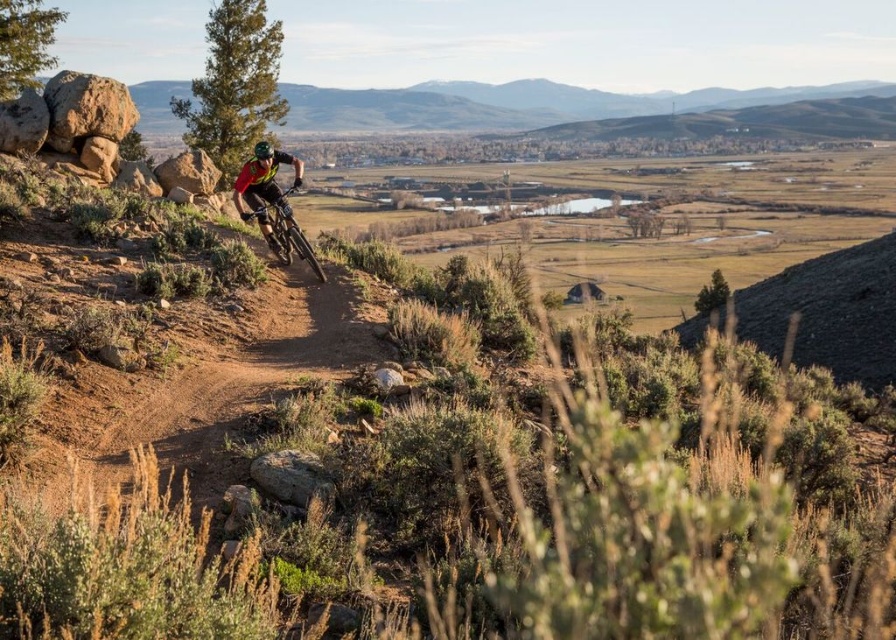
Which of these two, red fabric helmet at center or shiny metallic bicycle at center, stands shorter?

shiny metallic bicycle at center is shorter.

Can you confirm if red fabric helmet at center is wider than shiny metallic bicycle at center?

Indeed, red fabric helmet at center has a greater width compared to shiny metallic bicycle at center.

Image resolution: width=896 pixels, height=640 pixels. I want to click on red fabric helmet at center, so click(265, 188).

Locate an element on the screen. red fabric helmet at center is located at coordinates (265, 188).